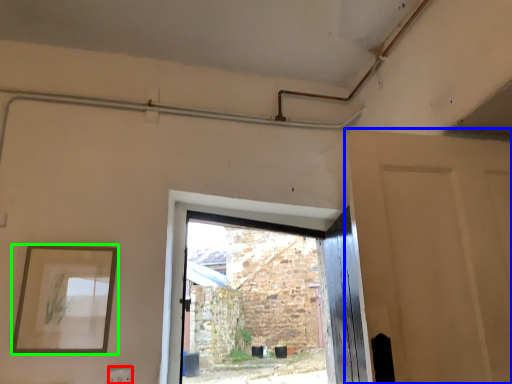
Question: Estimate the real-world distances between objects in this image. Which object is farther from electric outlet (highlighted by a red box), door (highlighted by a blue box) or picture frame (highlighted by a green box)?

Choices:
 (A) door
 (B) picture frame

Answer: (A)